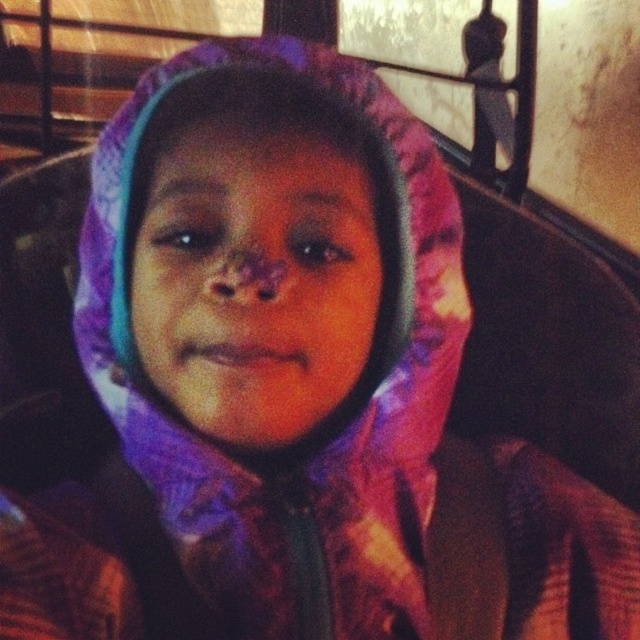
Is purple tie-dye hoodie at center shorter than multicolored fabric hood at center?

Indeed, purple tie-dye hoodie at center has a lesser height compared to multicolored fabric hood at center.

Is point (180, 236) positioned in front of point (385, 116)?

Yes, it is in front of point (385, 116).

This screenshot has height=640, width=640. What are the coordinates of `purple tie-dye hoodie at center` in the screenshot? It's located at (253, 280).